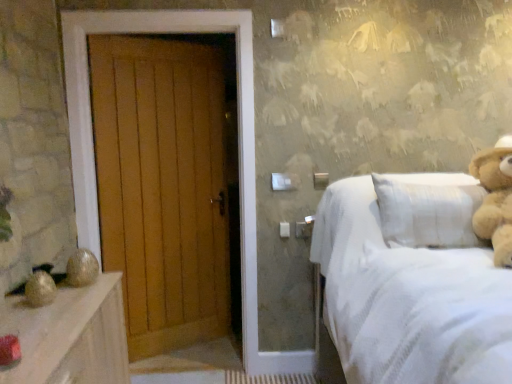
Question: From a real-world perspective, is light brown plush teddy bear at right physically below white textured bed at right?

Choices:
 (A) no
 (B) yes

Answer: (A)

Question: Is light brown plush teddy bear at right oriented towards white textured bed at right?

Choices:
 (A) no
 (B) yes

Answer: (B)

Question: Is light brown plush teddy bear at right at the left side of white textured bed at right?

Choices:
 (A) yes
 (B) no

Answer: (B)

Question: Considering the relative positions of light brown plush teddy bear at right and white textured bed at right in the image provided, is light brown plush teddy bear at right behind white textured bed at right?

Choices:
 (A) no
 (B) yes

Answer: (B)

Question: Considering the relative sizes of light brown plush teddy bear at right and white textured bed at right in the image provided, is light brown plush teddy bear at right thinner than white textured bed at right?

Choices:
 (A) no
 (B) yes

Answer: (B)

Question: Considering the positions of white textured bed at right and light brown plush teddy bear at right in the image, is white textured bed at right bigger or smaller than light brown plush teddy bear at right?

Choices:
 (A) big
 (B) small

Answer: (A)

Question: Would you say white textured bed at right is to the left or to the right of light brown plush teddy bear at right in the picture?

Choices:
 (A) left
 (B) right

Answer: (A)

Question: In the image, is white textured bed at right positioned in front of or behind light brown plush teddy bear at right?

Choices:
 (A) front
 (B) behind

Answer: (A)

Question: Considering the positions of point (373, 221) and point (504, 155), is point (373, 221) closer or farther from the camera than point (504, 155)?

Choices:
 (A) farther
 (B) closer

Answer: (B)

Question: From the image's perspective, relative to light brown plush teddy bear at right, is wooden door at left above or below?

Choices:
 (A) below
 (B) above

Answer: (A)

Question: Is wooden door at left to the left or to the right of light brown plush teddy bear at right in the image?

Choices:
 (A) right
 (B) left

Answer: (B)

Question: In terms of width, does wooden door at left look wider or thinner when compared to light brown plush teddy bear at right?

Choices:
 (A) wide
 (B) thin

Answer: (B)

Question: Considering the positions of wooden door at left and light brown plush teddy bear at right in the image, is wooden door at left taller or shorter than light brown plush teddy bear at right?

Choices:
 (A) short
 (B) tall

Answer: (B)

Question: Considering the relative positions of light brown plush teddy bear at right and white textured bed at right in the image provided, is light brown plush teddy bear at right to the left or to the right of white textured bed at right?

Choices:
 (A) right
 (B) left

Answer: (A)

Question: Considering their positions, is light brown plush teddy bear at right located in front of or behind white textured bed at right?

Choices:
 (A) behind
 (B) front

Answer: (A)